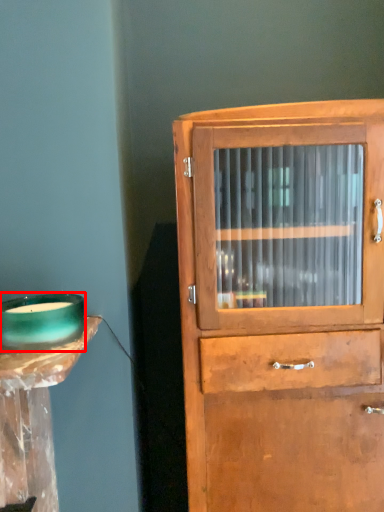
Question: Considering the relative positions of candle holder (annotated by the red box) and cupboard in the image provided, where is candle holder (annotated by the red box) located with respect to the staircase?

Choices:
 (A) left
 (B) right

Answer: (A)